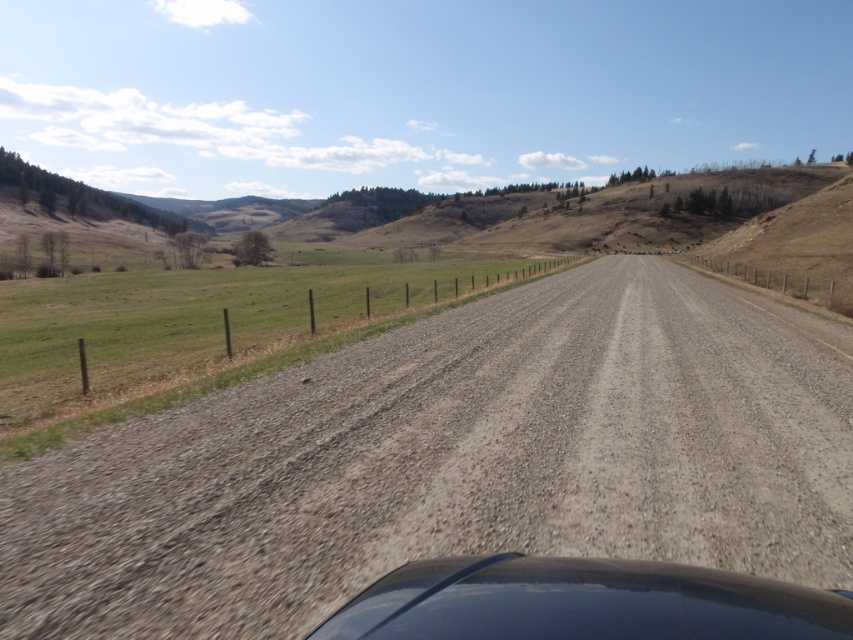
Which is more to the right, gray gravel road at center or glossy black car at center?

Positioned to the right is gray gravel road at center.

Can you confirm if gray gravel road at center is bigger than glossy black car at center?

Correct, gray gravel road at center is larger in size than glossy black car at center.

Image resolution: width=853 pixels, height=640 pixels. Identify the location of gray gravel road at center. (451, 461).

Find the location of a particular element. The image size is (853, 640). gray gravel road at center is located at coordinates (451, 461).